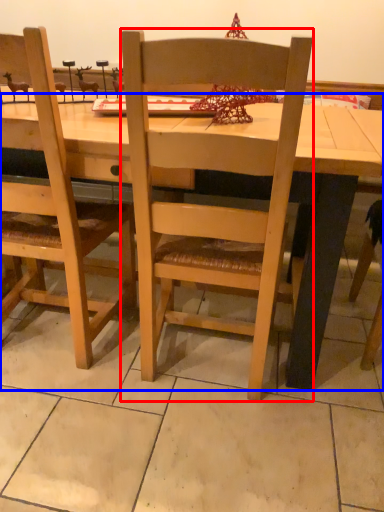
Question: Which point is further to the camera, chair (highlighted by a red box) or desk (highlighted by a blue box)?

Choices:
 (A) chair
 (B) desk

Answer: (B)